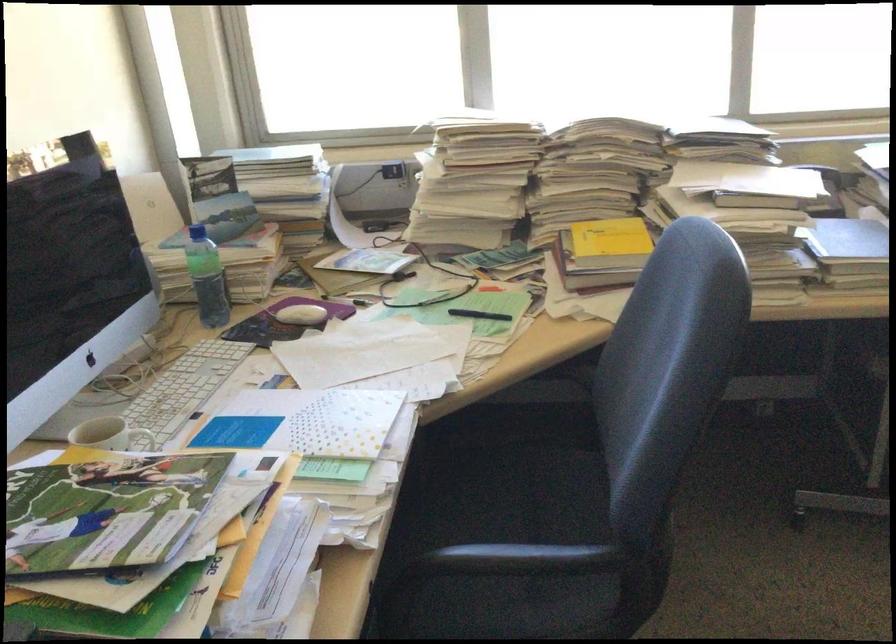
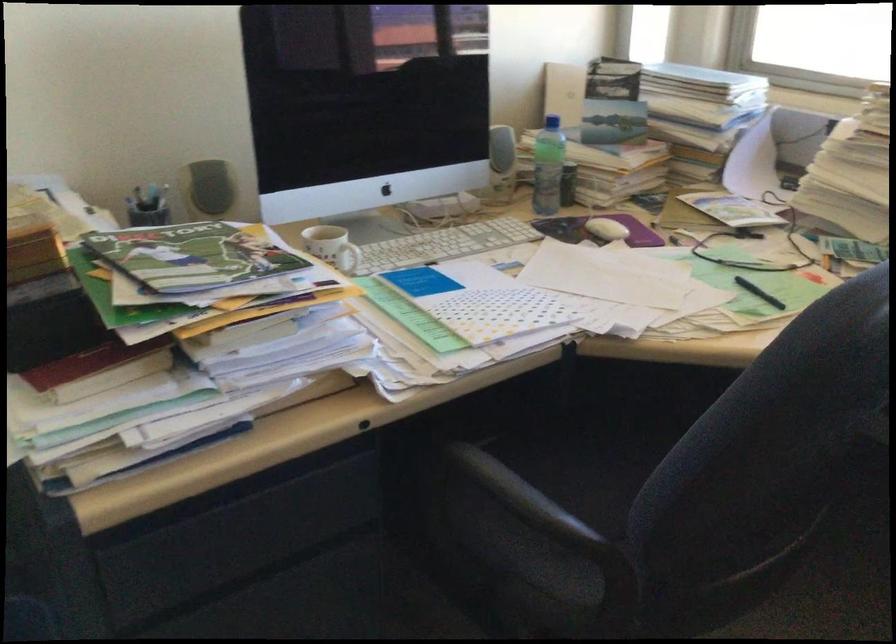
Question: I am providing you with two images of the same scene from different viewpoints. After the viewpoint changes to image2, which objects are now occluded?

Choices:
 (A) white computer mouse
 (B) black pen
 (C) black chair sitting surface
 (D) none of these

Answer: (D)